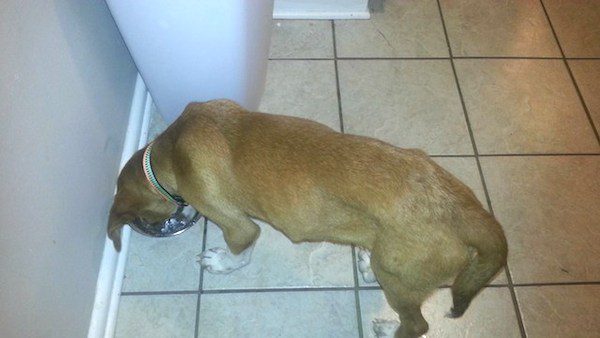
Locate an element on the screen. bathroom wall baseboard is located at coordinates (x=114, y=272), (x=335, y=9).